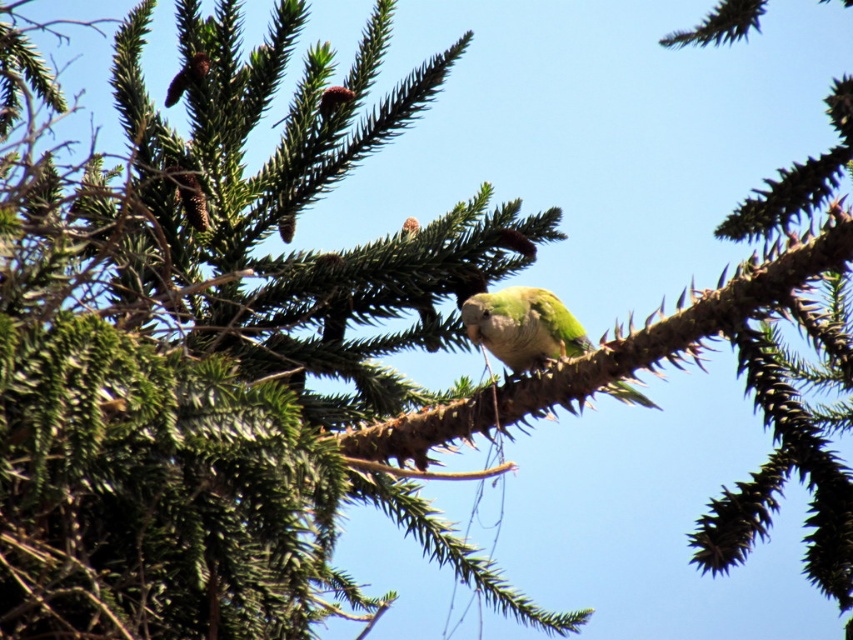
Question: Does green textured branch at center lie in front of green matte parrot at center?

Choices:
 (A) yes
 (B) no

Answer: (A)

Question: Is green textured branch at center in front of green feathered parrot at upper left?

Choices:
 (A) yes
 (B) no

Answer: (A)

Question: Can you confirm if green matte parrot at center is smaller than green feathered parrot at upper left?

Choices:
 (A) no
 (B) yes

Answer: (A)

Question: Which point appears farthest from the camera in this image?

Choices:
 (A) (558, 308)
 (B) (173, 80)

Answer: (B)

Question: Which object is the closest to the green matte parrot at center?

Choices:
 (A) green textured branch at center
 (B) green feathered parrot at upper left

Answer: (A)

Question: Which point appears farthest from the camera in this image?

Choices:
 (A) (834, 209)
 (B) (534, 289)
 (C) (193, 83)

Answer: (C)